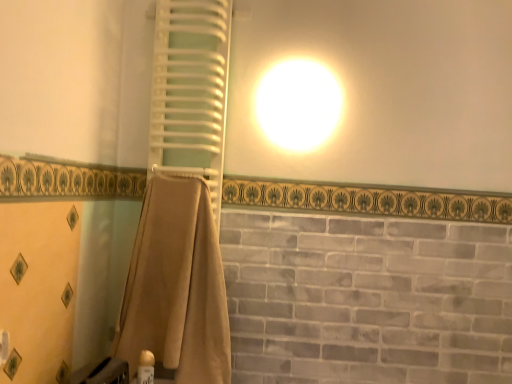
The height and width of the screenshot is (384, 512). What are the coordinates of `white plastic towel rack at upper left` in the screenshot? It's located at (190, 87).

Find the location of a particular element. Image resolution: width=512 pixels, height=384 pixels. gold plastic can at lower left is located at coordinates tap(146, 368).

Considering the points (193, 64) and (179, 342), which point is in front, point (193, 64) or point (179, 342)?

Positioned in front is point (179, 342).

Which object is further away from the camera taking this photo, white plastic towel rack at upper left or beige fabric towel at center?

Positioned behind is white plastic towel rack at upper left.

Is white plastic towel rack at upper left oriented away from beige fabric towel at center?

No, white plastic towel rack at upper left is not facing away from beige fabric towel at center.

Is white plastic towel rack at upper left to the right of beige fabric towel at center from the viewer's perspective?

Yes.

From the image's perspective, between beige fabric towel at center and white plastic towel rack at upper left, which one is located above?

white plastic towel rack at upper left, from the image's perspective.

Measure the distance from beige fabric towel at center to white plastic towel rack at upper left.

They are 16.26 inches apart.

Is point (164, 323) more distant than point (213, 58)?

No, (164, 323) is closer to viewer.

Is beige fabric towel at center spatially inside gold plastic can at lower left, or outside of it?

beige fabric towel at center is outside gold plastic can at lower left.

Which object is closer to the camera taking this photo, beige fabric towel at center or gold plastic can at lower left?

gold plastic can at lower left.

Is beige fabric towel at center to the right of gold plastic can at lower left from the viewer's perspective?

Correct, you'll find beige fabric towel at center to the right of gold plastic can at lower left.

Based on the photo, is beige fabric towel at center taller or shorter than gold plastic can at lower left?

beige fabric towel at center is taller than gold plastic can at lower left.

Could you tell me if gold plastic can at lower left is turned towards beige fabric towel at center?

No.

In the scene shown: From a real-world perspective, is gold plastic can at lower left positioned under beige fabric towel at center based on gravity?

Correct, in the physical world, gold plastic can at lower left is lower than beige fabric towel at center.

Looking at this image, how much distance is there between gold plastic can at lower left and beige fabric towel at center?

gold plastic can at lower left is 10.44 inches away from beige fabric towel at center.

Is gold plastic can at lower left at the right side of beige fabric towel at center?

No, gold plastic can at lower left is not to the right of beige fabric towel at center.

How different are the orientations of white plastic towel rack at upper left and gold plastic can at lower left in degrees?

There is a 84.4-degree angle between the facing directions of white plastic towel rack at upper left and gold plastic can at lower left.

Which is nearer, (168, 136) or (146, 375)?

Clearly, point (168, 136) is more distant from the camera than point (146, 375).

Is gold plastic can at lower left at the back of white plastic towel rack at upper left?

No.

Is gold plastic can at lower left aimed at white plastic towel rack at upper left?

No, gold plastic can at lower left is not aimed at white plastic towel rack at upper left.

From the image's perspective, who appears lower, gold plastic can at lower left or white plastic towel rack at upper left?

gold plastic can at lower left, from the image's perspective.

Who is more distant, gold plastic can at lower left or white plastic towel rack at upper left?

white plastic towel rack at upper left is further away from the camera.

The image size is (512, 384). Find the location of `shutter on the right of gold plastic can at lower left`. shutter on the right of gold plastic can at lower left is located at coordinates (190, 87).

Where is `shutter behind the beige fabric towel at center`? This screenshot has width=512, height=384. shutter behind the beige fabric towel at center is located at coordinates (190, 87).

Find the location of a particular element. curtain that appears below the white plastic towel rack at upper left (from a real-world perspective) is located at coordinates (176, 286).

Estimate the real-world distances between objects in this image. Which object is closer to white plastic towel rack at upper left, beige fabric towel at center or gold plastic can at lower left?

beige fabric towel at center.

Looking at the image, which one is located further to gold plastic can at lower left, white plastic towel rack at upper left or beige fabric towel at center?

white plastic towel rack at upper left is further to gold plastic can at lower left.

Estimate the real-world distances between objects in this image. Which object is closer to white plastic towel rack at upper left, gold plastic can at lower left or beige fabric towel at center?

The object closer to white plastic towel rack at upper left is beige fabric towel at center.

Estimate the real-world distances between objects in this image. Which object is closer to beige fabric towel at center, gold plastic can at lower left or white plastic towel rack at upper left?

gold plastic can at lower left.

Looking at the image, which one is located further to beige fabric towel at center, white plastic towel rack at upper left or gold plastic can at lower left?

white plastic towel rack at upper left.

Which object lies further to the anchor point gold plastic can at lower left, beige fabric towel at center or white plastic towel rack at upper left?

Among the two, white plastic towel rack at upper left is located further to gold plastic can at lower left.

This screenshot has width=512, height=384. What are the coordinates of `curtain between white plastic towel rack at upper left and gold plastic can at lower left in the up-down direction` in the screenshot? It's located at (176, 286).